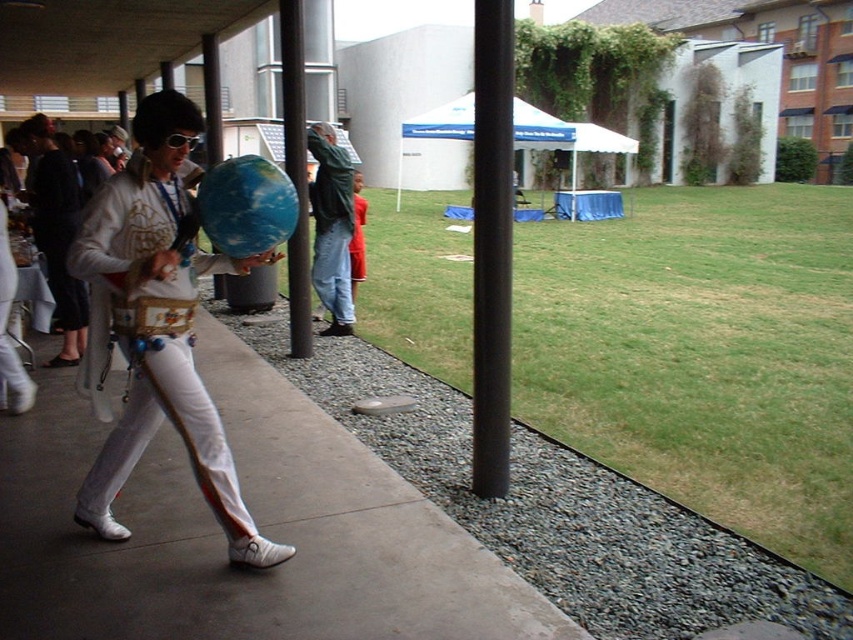
Question: Does white satin suit at center have a lesser width compared to black metal pole at center?

Choices:
 (A) no
 (B) yes

Answer: (B)

Question: Which point is farther from the camera taking this photo?

Choices:
 (A) [163, 150]
 (B) [329, 508]
 (C) [74, 340]
 (D) [335, 262]

Answer: (D)

Question: Which of these objects is positioned farthest from the concrete at center?

Choices:
 (A) black metal pole at center
 (B) shiny gold belt at center
 (C) black matte pole at center
 (D) jeans at center

Answer: (D)

Question: Estimate the real-world distances between objects in this image. Which object is closer to the black metal pole at center?

Choices:
 (A) white satin suit at center
 (B) shiny gold belt at center

Answer: (B)

Question: Is shiny gold belt at center wider than black matte pole at center?

Choices:
 (A) no
 (B) yes

Answer: (B)

Question: Is concrete at center positioned at the back of black matte pole at center?

Choices:
 (A) no
 (B) yes

Answer: (A)